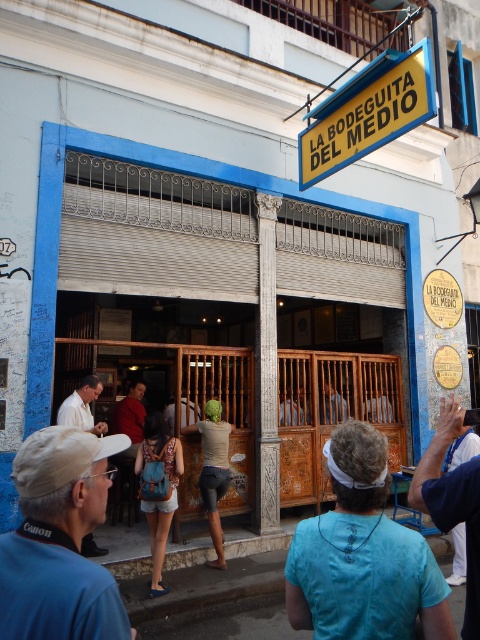
Question: Among these points, which one is farthest from the camera?

Choices:
 (A) (88, 564)
 (B) (124, 404)

Answer: (B)

Question: Which point appears farthest from the camera in this image?

Choices:
 (A) (322, 417)
 (B) (305, 152)
 (C) (479, 516)

Answer: (A)

Question: Can you confirm if denim shorts at center is thinner than light brown wooden door at center?

Choices:
 (A) no
 (B) yes

Answer: (A)

Question: Does red shirt at center have a smaller size compared to wooden door at center?

Choices:
 (A) no
 (B) yes

Answer: (A)

Question: Where is white shirt at left located in relation to wooden door at center in the image?

Choices:
 (A) below
 (B) above

Answer: (B)

Question: Which of these objects is positioned closest to the light brown wooden door at center?

Choices:
 (A) denim shorts at center
 (B) blue fabric cap at lower left
 (C) yellowsignboardla bodeguita del medio at upper center

Answer: (A)